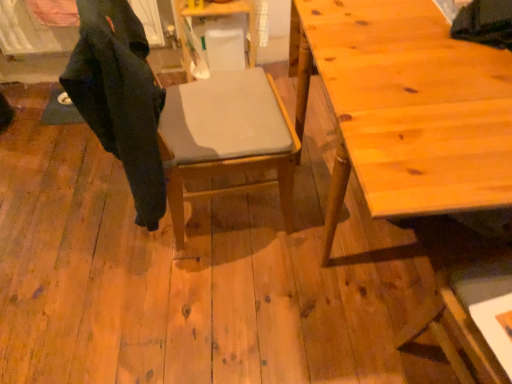
Question: Is wooden table at right, which is the first table in bottom-to-top order, at the right side of matte gray cushion at center?

Choices:
 (A) yes
 (B) no

Answer: (A)

Question: Is wooden table at right, which is counted as the 1th table, starting from the front, wider than matte gray cushion at center?

Choices:
 (A) yes
 (B) no

Answer: (A)

Question: Are wooden table at right, the first table positioned from the right, and matte gray cushion at center far apart?

Choices:
 (A) yes
 (B) no

Answer: (B)

Question: Is wooden table at right, acting as the 2th table starting from the left, thinner than matte gray cushion at center?

Choices:
 (A) yes
 (B) no

Answer: (B)

Question: From a real-world perspective, is wooden table at right, which is the first table in bottom-to-top order, located higher than matte gray cushion at center?

Choices:
 (A) no
 (B) yes

Answer: (A)

Question: From the image's perspective, is wooden table at right, acting as the 2th table starting from the left, above or below matte gray cushion at center?

Choices:
 (A) below
 (B) above

Answer: (A)

Question: From a real-world perspective, relative to matte gray cushion at center, is wooden table at right, acting as the 2th table starting from the left, vertically above or below?

Choices:
 (A) above
 (B) below

Answer: (B)

Question: Looking at their shapes, would you say wooden table at right, the first table positioned from the right, is wider or thinner than matte gray cushion at center?

Choices:
 (A) thin
 (B) wide

Answer: (B)

Question: Would you say wooden table at right, the first table positioned from the right, is to the left or to the right of matte gray cushion at center in the picture?

Choices:
 (A) right
 (B) left

Answer: (A)

Question: From the image's perspective, is dark matte fabric robe at left above or below wooden table at right, which is the first table in bottom-to-top order?

Choices:
 (A) above
 (B) below

Answer: (A)

Question: In terms of size, does dark matte fabric robe at left appear bigger or smaller than wooden table at right, the first table positioned from the right?

Choices:
 (A) big
 (B) small

Answer: (B)

Question: Considering the positions of dark matte fabric robe at left and wooden table at right, the 2th table positioned from the top, in the image, is dark matte fabric robe at left wider or thinner than wooden table at right, the 2th table positioned from the top,?

Choices:
 (A) thin
 (B) wide

Answer: (A)

Question: Do you think dark matte fabric robe at left is within wooden table at right, the 2th table positioned from the top, or outside of it?

Choices:
 (A) inside
 (B) outside

Answer: (B)

Question: From their relative heights in the image, would you say wooden table at center, which is the second table in bottom-to-top order, is taller or shorter than wooden table at right, which is counted as the 2th table, starting from the back?

Choices:
 (A) tall
 (B) short

Answer: (B)

Question: From a real-world perspective, is wooden table at center, acting as the 2th table starting from the front, positioned above or below wooden table at right, the first table positioned from the right?

Choices:
 (A) below
 (B) above

Answer: (A)